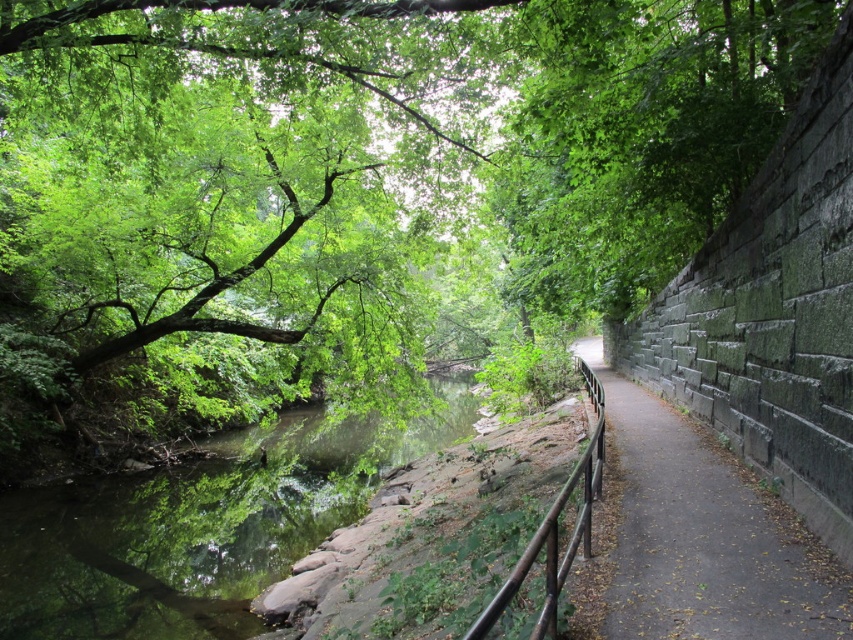
Question: Which object appears closest to the camera in this image?

Choices:
 (A) gray concrete path at right
 (B) green reflective water at center

Answer: (A)

Question: Is gray concrete path at right positioned in front of brown wooden rail at center?

Choices:
 (A) no
 (B) yes

Answer: (A)

Question: Does green reflective water at center appear under gray concrete path at right?

Choices:
 (A) yes
 (B) no

Answer: (A)

Question: Where is green reflective water at center located in relation to brown wooden rail at center in the image?

Choices:
 (A) below
 (B) above

Answer: (A)

Question: Estimate the real-world distances between objects in this image. Which object is farther from the gray concrete path at right?

Choices:
 (A) green reflective water at center
 (B) brown wooden rail at center

Answer: (A)

Question: Which point is farther to the camera?

Choices:
 (A) (128, 532)
 (B) (732, 576)

Answer: (A)